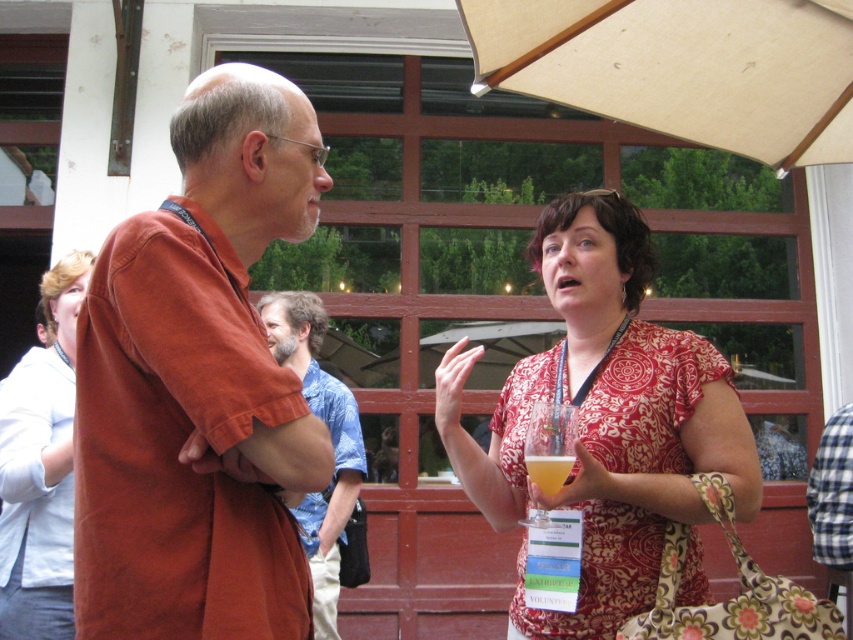
Is patterned fabric dress at center positioned at the back of blue floral shirt at center?

No, it is not.

Is point (525, 428) closer to camera compared to point (291, 323)?

Yes, point (525, 428) is in front of point (291, 323).

Find the location of a particular element. This screenshot has height=640, width=853. patterned fabric dress at center is located at coordinates (604, 417).

Between matte orange shirt at center and translucent plastic cup at center, which one is positioned lower?

Positioned lower is translucent plastic cup at center.

Is point (204, 401) less distant than point (558, 481)?

Yes, it is.

Which is behind, point (138, 225) or point (531, 456)?

The point (531, 456) is more distant.

Where is `matte orange shirt at center`? matte orange shirt at center is located at coordinates (199, 385).

Which is behind, point (567, 61) or point (39, 440)?

Positioned behind is point (567, 61).

You are a GUI agent. You are given a task and a screenshot of the screen. Output one action in this format:
    pyautogui.click(x=<x>, y=<y>)
    Task: Click on the beige fabric umbrella at upper center
    The image size is (853, 640).
    Given the screenshot: What is the action you would take?
    pyautogui.click(x=682, y=67)

Between point (724, 26) and point (57, 388), which one is positioned behind?

The point (57, 388) is behind.

Where is `beige fabric umbrella at upper center`? The width and height of the screenshot is (853, 640). beige fabric umbrella at upper center is located at coordinates (682, 67).